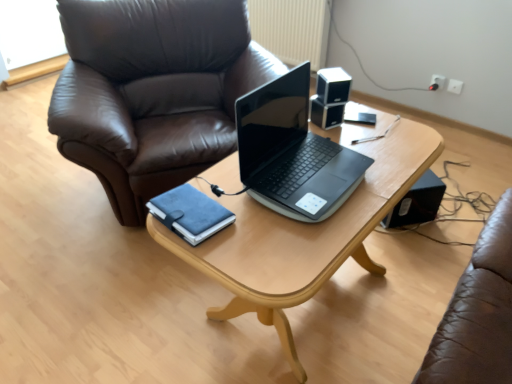
Question: Does black plastic speaker at lower right, which is the 3th speaker from top to bottom, have a larger size compared to sleek black laptop at center?

Choices:
 (A) no
 (B) yes

Answer: (A)

Question: From a real-world perspective, is black plastic speaker at lower right, the 1th speaker when ordered from back to front, over sleek black laptop at center?

Choices:
 (A) yes
 (B) no

Answer: (B)

Question: Is black plastic speaker at lower right, placed as the third speaker when sorted from left to right, touching sleek black laptop at center?

Choices:
 (A) no
 (B) yes

Answer: (A)

Question: Can sleek black laptop at center be found inside black plastic speaker at lower right, which is the 1th speaker from bottom to top?

Choices:
 (A) no
 (B) yes

Answer: (A)

Question: Does black plastic speaker at lower right, which is the 3th speaker from top to bottom, appear on the right side of sleek black laptop at center?

Choices:
 (A) no
 (B) yes

Answer: (B)

Question: In terms of width, does white plastic electric outlet at upper right look wider or thinner when compared to light wood table at center?

Choices:
 (A) wide
 (B) thin

Answer: (B)

Question: From a real-world perspective, is white plastic electric outlet at upper right positioned above or below light wood table at center?

Choices:
 (A) above
 (B) below

Answer: (B)

Question: Considering their positions, is white plastic electric outlet at upper right located in front of or behind light wood table at center?

Choices:
 (A) front
 (B) behind

Answer: (B)

Question: Considering the relative positions of white plastic electric outlet at upper right and light wood table at center in the image provided, is white plastic electric outlet at upper right to the left or to the right of light wood table at center?

Choices:
 (A) right
 (B) left

Answer: (A)

Question: From the image's perspective, relative to sleek black laptop at center, is suede blue notebook at center above or below?

Choices:
 (A) above
 (B) below

Answer: (B)

Question: From a real-world perspective, is suede blue notebook at center physically located above or below sleek black laptop at center?

Choices:
 (A) above
 (B) below

Answer: (B)

Question: Considering the positions of suede blue notebook at center and sleek black laptop at center in the image, is suede blue notebook at center bigger or smaller than sleek black laptop at center?

Choices:
 (A) small
 (B) big

Answer: (A)

Question: In terms of width, does suede blue notebook at center look wider or thinner when compared to sleek black laptop at center?

Choices:
 (A) thin
 (B) wide

Answer: (A)

Question: Is black glossy speaker at upper right, positioned as the third speaker in bottom-to-top order, wider or thinner than suede blue notebook at center?

Choices:
 (A) wide
 (B) thin

Answer: (B)

Question: Does point (324, 92) appear closer or farther from the camera than point (164, 208)?

Choices:
 (A) closer
 (B) farther

Answer: (B)